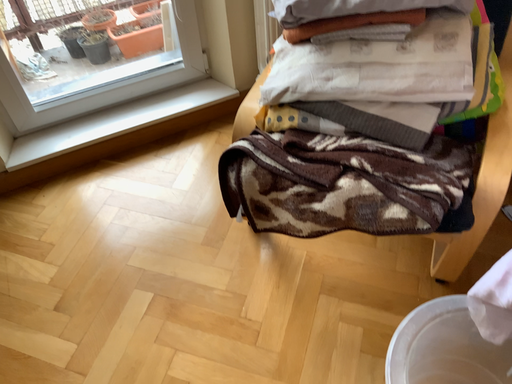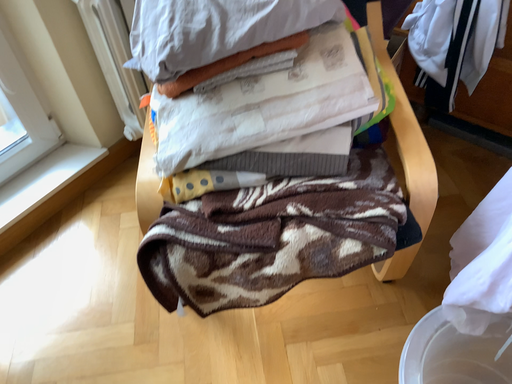
Question: Which way did the camera rotate in the video?

Choices:
 (A) rotated left
 (B) rotated right

Answer: (B)